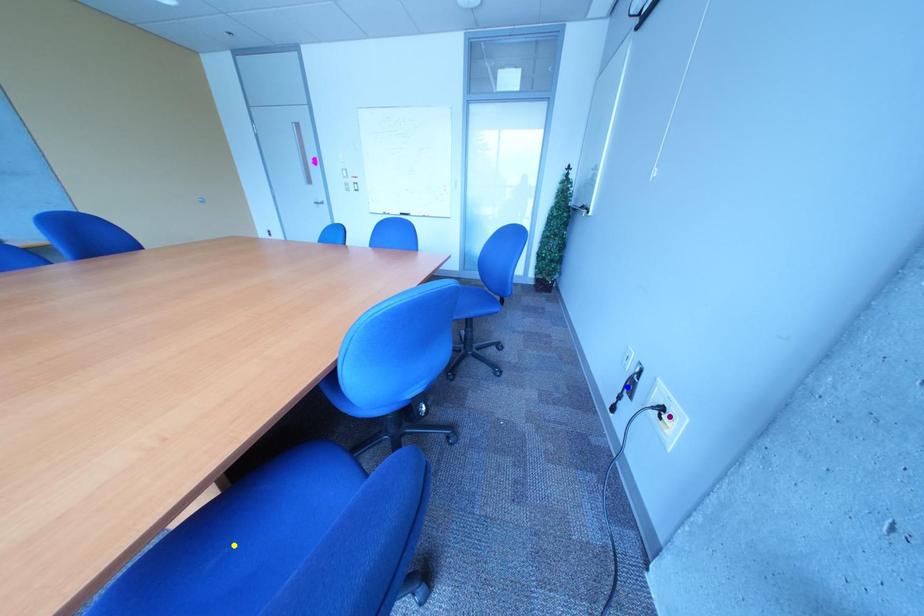
Order these from farthest to nearest:
blue point, yellow point, purple point

blue point → purple point → yellow point